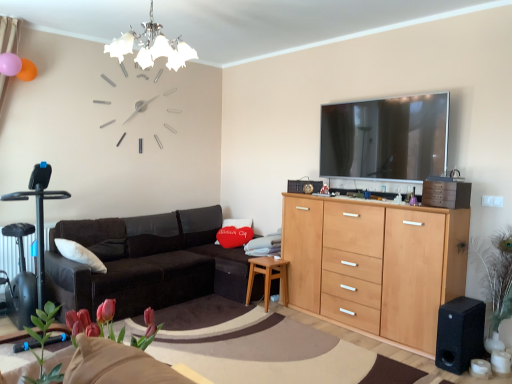
Where is `vacant area that lies in front of light brown wooden side table at lower center`? vacant area that lies in front of light brown wooden side table at lower center is located at coordinates (267, 310).